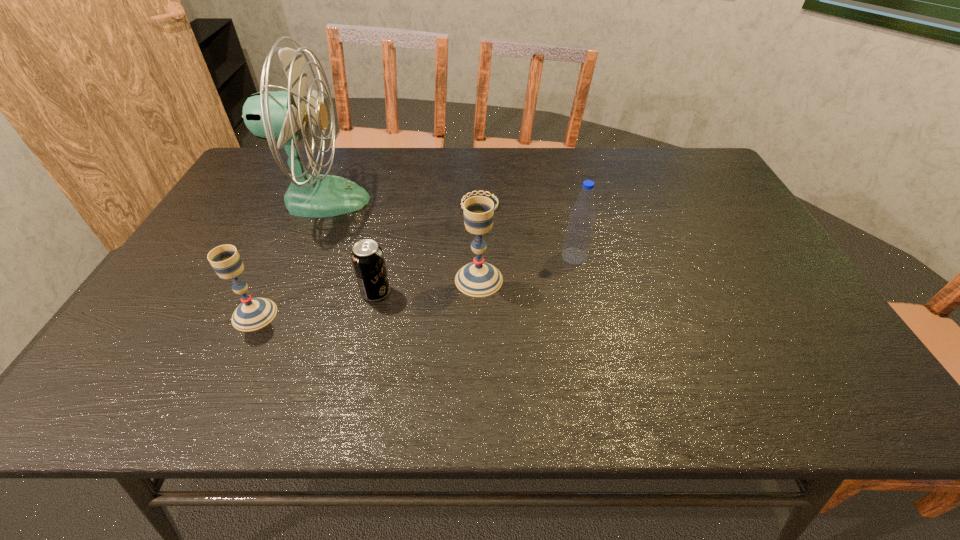
I want to click on the shorter chalice, so click(254, 313).

Where is `the fourth tallest object`? The height and width of the screenshot is (540, 960). the fourth tallest object is located at coordinates (254, 313).

Where is `the right chalice`? the right chalice is located at coordinates (477, 279).

You are a GUI agent. You are given a task and a screenshot of the screen. Output one action in this format:
    pyautogui.click(x=<x>, y=<y>)
    Task: Click on the taller chalice
    
    Given the screenshot: What is the action you would take?
    pyautogui.click(x=477, y=279)

The height and width of the screenshot is (540, 960). Find the location of `fan`. fan is located at coordinates (283, 115).

The height and width of the screenshot is (540, 960). I want to click on bracelet, so click(x=492, y=195).

I want to click on the rightmost object, so 579,230.

I want to click on soda can, so click(367, 256).

Where is `the fourth object from right to left`? The image size is (960, 540). the fourth object from right to left is located at coordinates (367, 256).

Identify the location of vacant space situated 0.350m on the back of the fourth tallest object. The height and width of the screenshot is (540, 960). (304, 210).